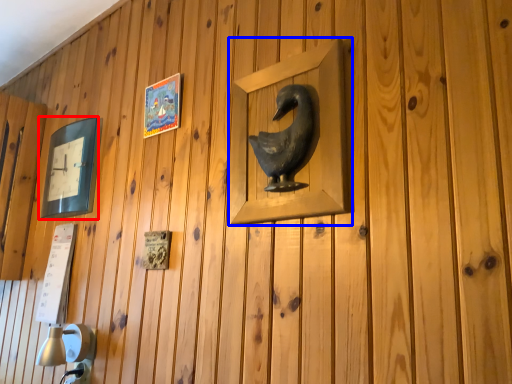
Question: Which object appears closest to the camera in this image, picture frame (highlighted by a red box) or picture frame (highlighted by a blue box)?

Choices:
 (A) picture frame
 (B) picture frame

Answer: (B)